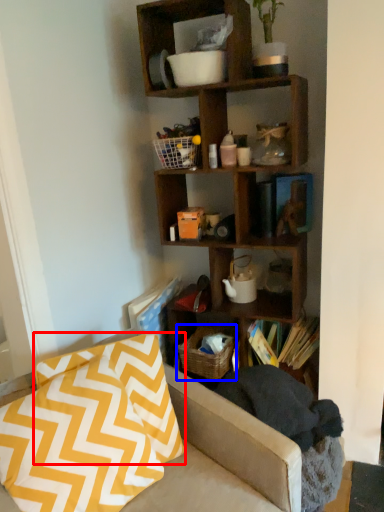
Question: Which point is closer to the camera, pillow (highlighted by a red box) or basket (highlighted by a blue box)?

Choices:
 (A) pillow
 (B) basket

Answer: (A)